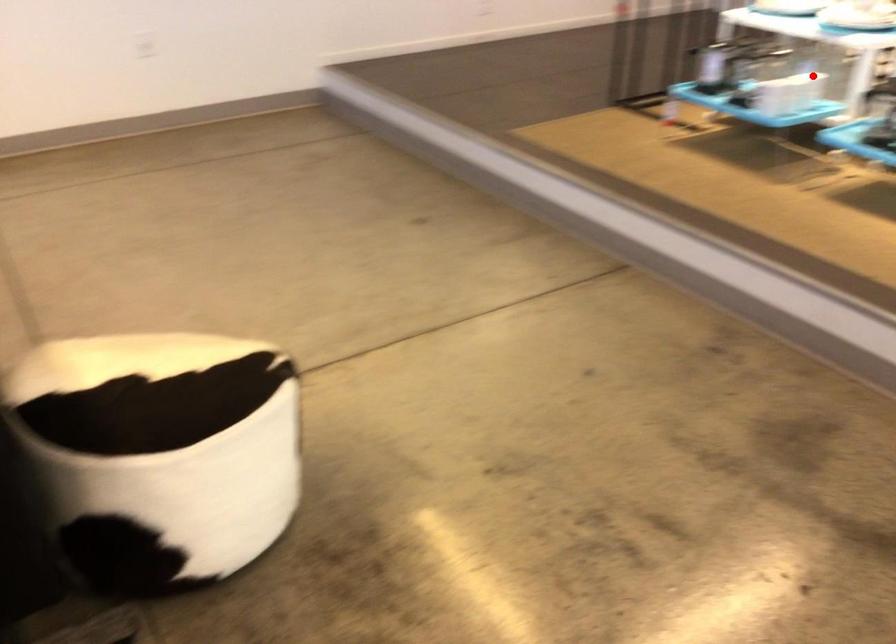
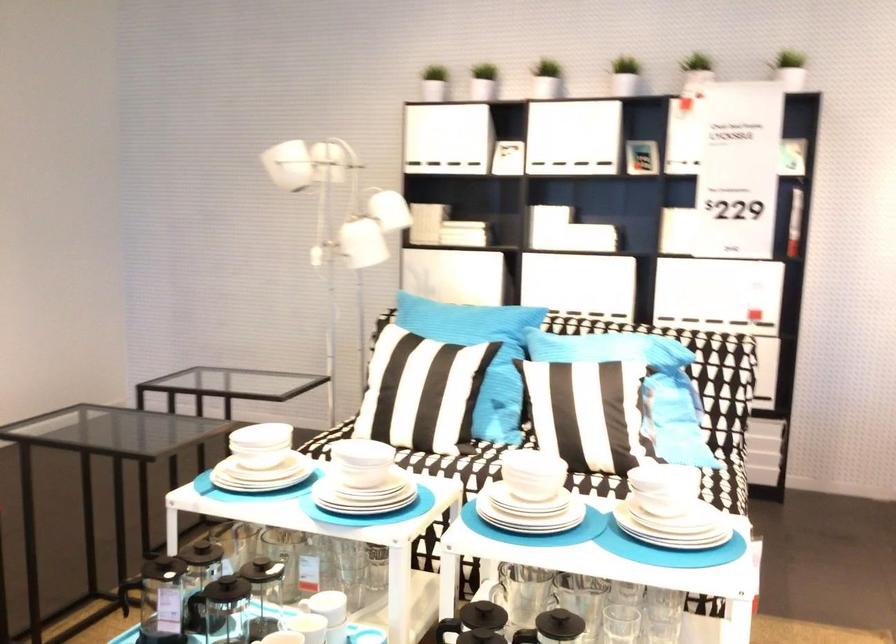
Question: I am providing you with two images of the same scene from different viewpoints. Image1 has a red point marked. In image2, the corresponding 3D location appears at what relative position? Reply with the corresponding letter.

Choices:
 (A) Closer
 (B) Farther

Answer: (A)